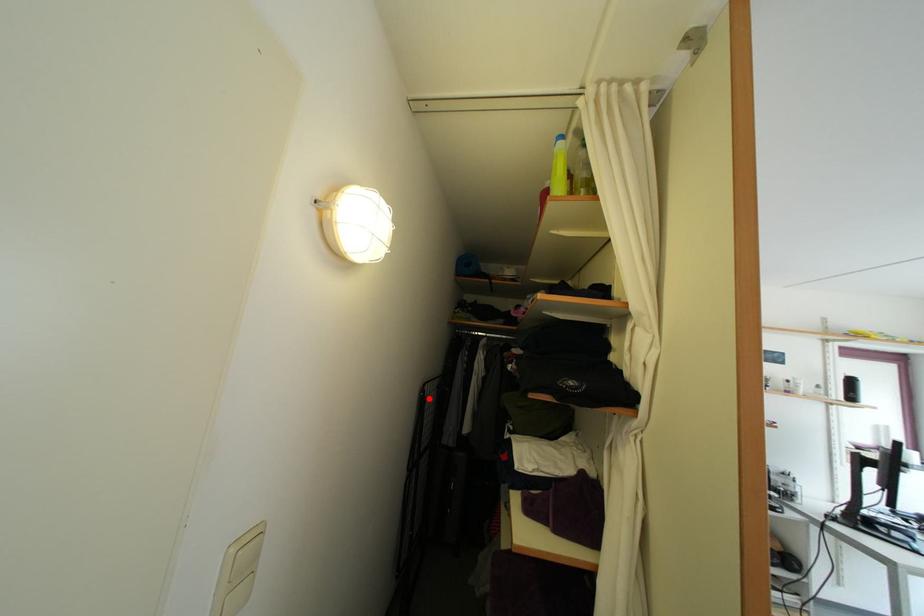
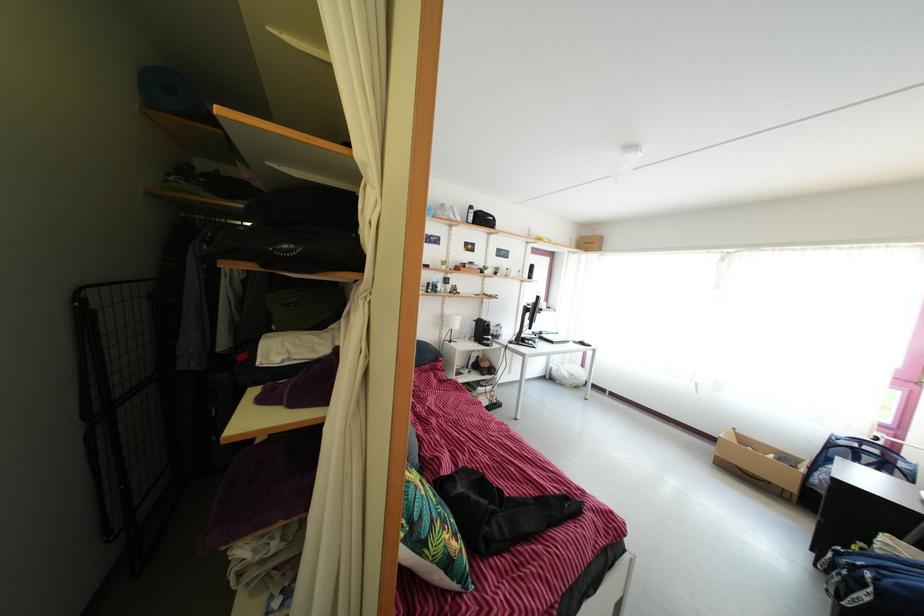
Where in the second image is the point corresponding to the highlighted location from the first image?

(86, 307)